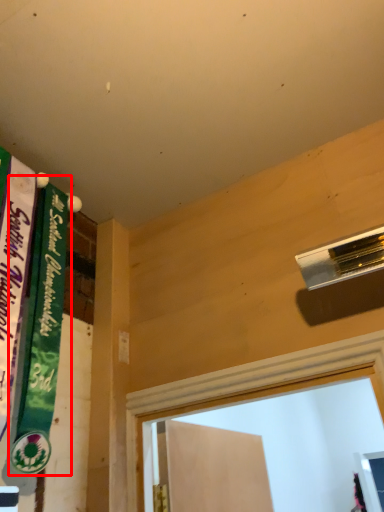
Question: From the image's perspective, what is the correct spatial positioning of bulletin board (annotated by the red box) in reference to bulletin board?

Choices:
 (A) above
 (B) below

Answer: (B)